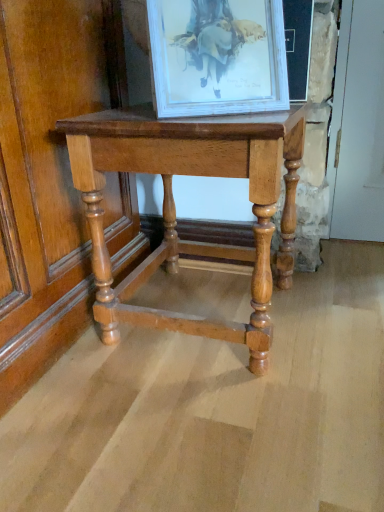
Question: Is white glossy picture frame at upper center located outside polished wood table at center?

Choices:
 (A) no
 (B) yes

Answer: (B)

Question: From a real-world perspective, is white glossy picture frame at upper center located higher than polished wood table at center?

Choices:
 (A) yes
 (B) no

Answer: (A)

Question: Is white glossy picture frame at upper center in front of polished wood table at center?

Choices:
 (A) no
 (B) yes

Answer: (B)

Question: Could you tell me if white glossy picture frame at upper center is facing polished wood table at center?

Choices:
 (A) yes
 (B) no

Answer: (B)

Question: Can you confirm if white glossy picture frame at upper center is thinner than polished wood table at center?

Choices:
 (A) no
 (B) yes

Answer: (B)

Question: Does white glossy picture frame at upper center have a greater width compared to polished wood table at center?

Choices:
 (A) no
 (B) yes

Answer: (A)

Question: From the image's perspective, would you say polished wood table at center is shown under white glossy picture frame at upper center?

Choices:
 (A) yes
 (B) no

Answer: (A)

Question: Can you confirm if polished wood table at center is positioned to the left of white glossy picture frame at upper center?

Choices:
 (A) yes
 (B) no

Answer: (A)

Question: Could white glossy picture frame at upper center be considered to be inside polished wood table at center?

Choices:
 (A) no
 (B) yes

Answer: (A)

Question: Does polished wood table at center have a greater width compared to white glossy picture frame at upper center?

Choices:
 (A) no
 (B) yes

Answer: (B)

Question: From a real-world perspective, is polished wood table at center physically below white glossy picture frame at upper center?

Choices:
 (A) yes
 (B) no

Answer: (A)

Question: Does polished wood table at center lie in front of white glossy picture frame at upper center?

Choices:
 (A) yes
 (B) no

Answer: (B)

Question: From a real-world perspective, is polished wood table at center above or below white glossy picture frame at upper center?

Choices:
 (A) above
 (B) below

Answer: (B)